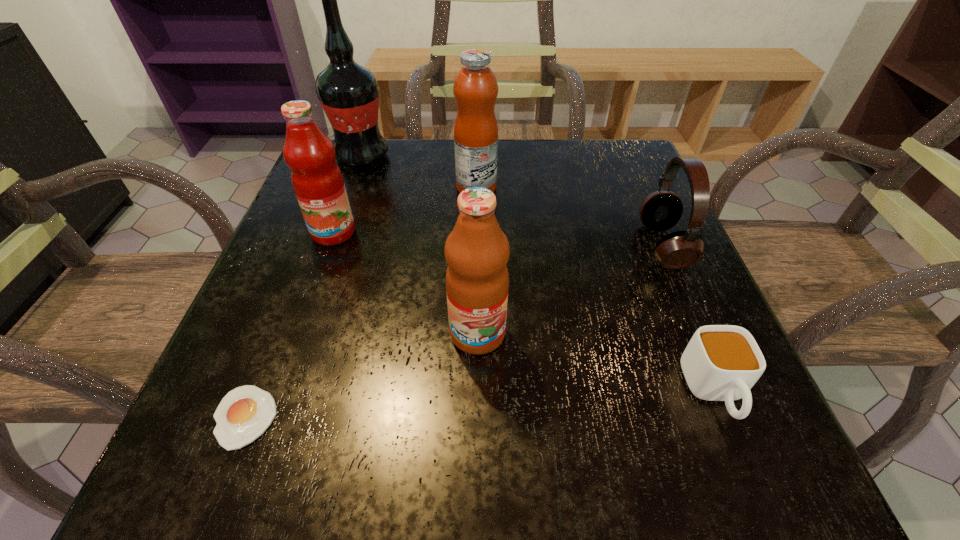
Locate an element on the screen. This screenshot has height=540, width=960. free space at the near edge of the desktop is located at coordinates (500, 436).

Where is `vacant region at the left edge of the desktop`? The image size is (960, 540). vacant region at the left edge of the desktop is located at coordinates (357, 205).

Locate an element on the screen. The width and height of the screenshot is (960, 540). blank space at the right edge is located at coordinates (596, 240).

This screenshot has height=540, width=960. I want to click on free point at the near left corner, so click(x=209, y=491).

What are the coordinates of `blank space at the far right corner` in the screenshot? It's located at (652, 182).

Locate an element on the screen. Image resolution: width=960 pixels, height=540 pixels. vacant area at the near right corner is located at coordinates (655, 425).

At what (x,y) coordinates should I click in order to perform the action: click on free space between the farthest fruit juice and the shortest object. Please return your answer as a coordinate pair (x, y). This screenshot has height=540, width=960. Looking at the image, I should click on (361, 302).

Where is `vacant area between the second farthest fruit juice and the wine bottle`? This screenshot has height=540, width=960. vacant area between the second farthest fruit juice and the wine bottle is located at coordinates (348, 194).

Find the location of a particular element. free space between the second shortest object and the egg yolk is located at coordinates (480, 404).

Locate an element on the screen. This screenshot has width=960, height=540. free point between the third shortest object and the second shortest object is located at coordinates [689, 319].